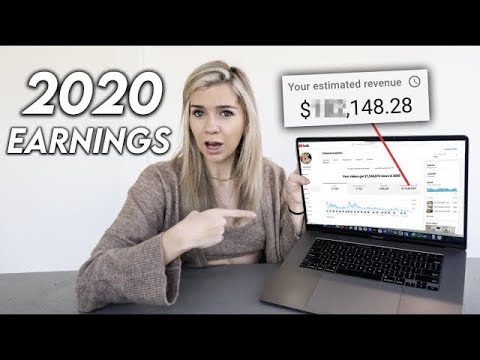
Locate an element on the screen. This screenshot has width=480, height=360. laptop screen is located at coordinates (380, 161).